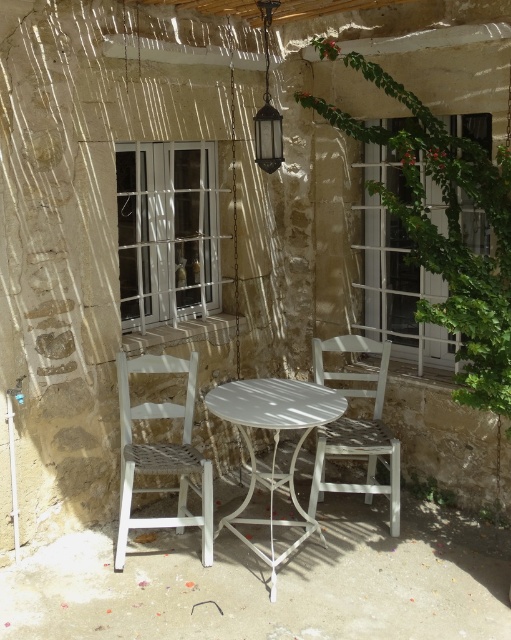
You are a guest at this outdoor seating area and want to sit down. You see the white woven chair at left and the matte glass lantern at upper center. Which object is positioned more to the left side of the seating area?

The white woven chair at left is positioned more to the left side of the seating area than the matte glass lantern at upper center.

You are standing in the outdoor seating area and want to place a small decoration between the two points marked as point 1 at point (284,380) and point 2 at point (267,64). Which point should you place the decoration closer to so that it appears larger in the camera view?

You should place the decoration closer to point 1 at point (284,380) because it is closer to the camera, making it appear larger in the view.